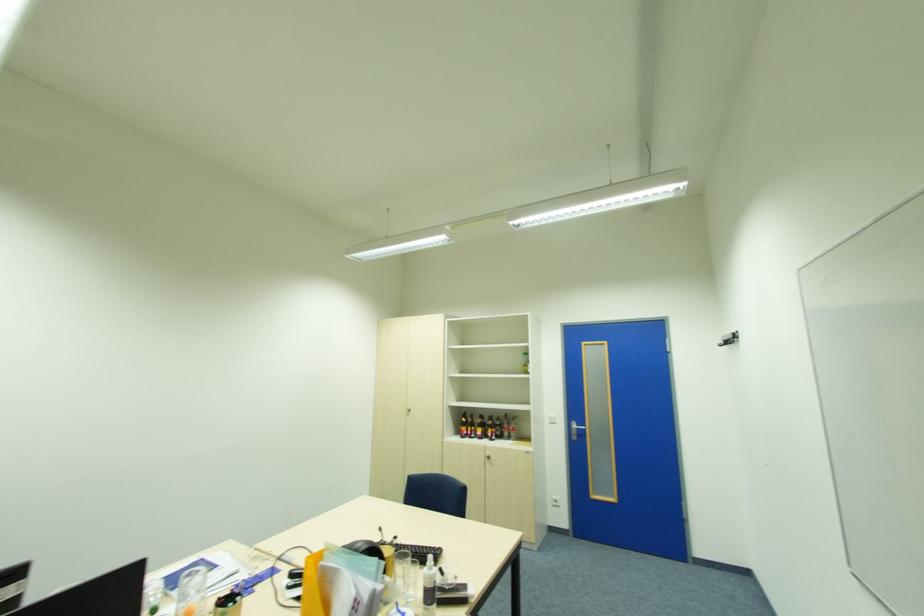
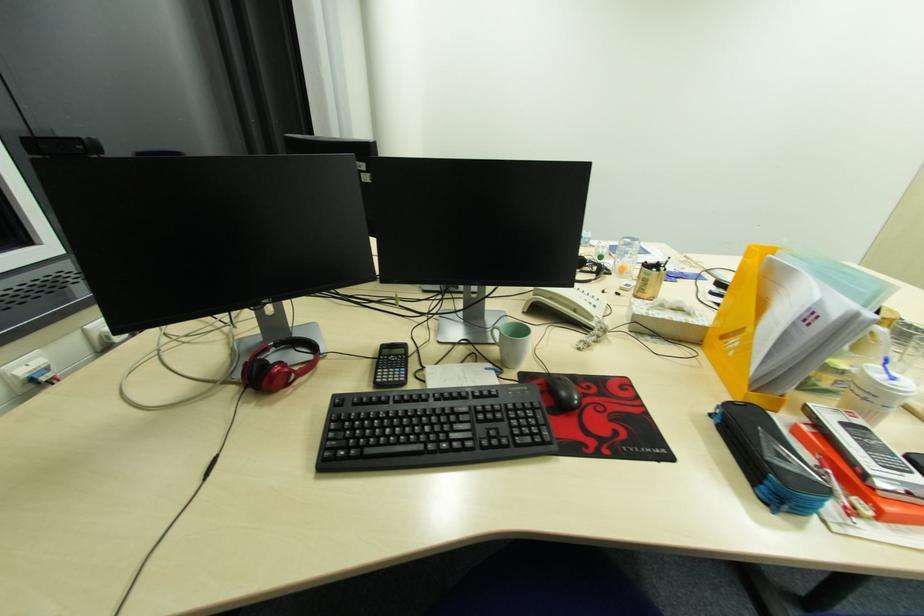
The first image is from the beginning of the video and the second image is from the end. How did the camera likely rotate when shooting the video?

The camera's rotation is toward left-down.